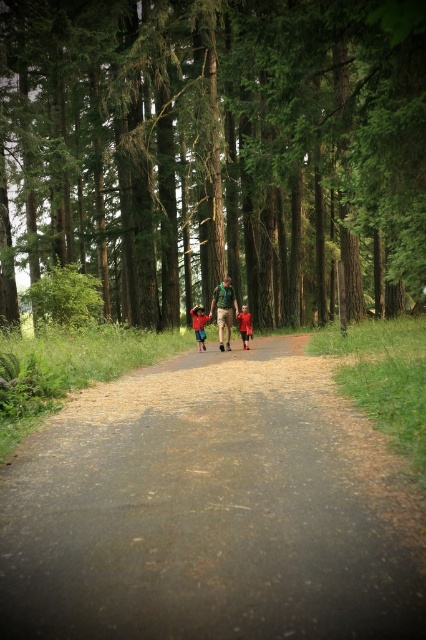
Question: Which point is farther from the camera taking this photo?

Choices:
 (A) (222, 332)
 (B) (388, 225)
 (C) (204, 317)

Answer: (C)

Question: Which object appears farthest from the camera in this image?

Choices:
 (A) red velvet coat at center
 (B) green textured tree at center
 (C) green fabric shirt at center

Answer: (A)

Question: Which point is farther to the camera?

Choices:
 (A) (409, 630)
 (B) (273, 20)
 (C) (252, 333)
 (D) (196, 308)

Answer: (D)

Question: Considering the relative positions of green textured tree at center and dirt road at center in the image provided, where is green textured tree at center located with respect to dirt road at center?

Choices:
 (A) left
 (B) right

Answer: (B)

Question: Is green textured tree at center to the left of dirt road at center from the viewer's perspective?

Choices:
 (A) no
 (B) yes

Answer: (A)

Question: Is red fabric shirt at center to the right of red velvet coat at center from the viewer's perspective?

Choices:
 (A) no
 (B) yes

Answer: (A)